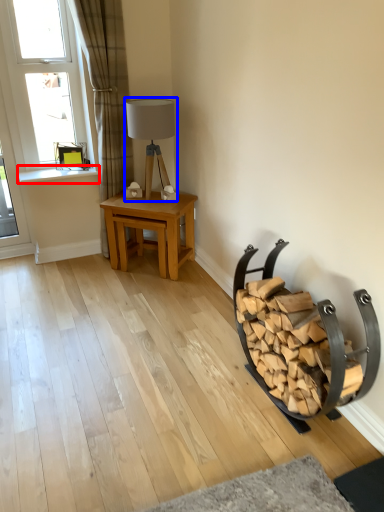
Question: Which object appears farthest to the camera in this image, window sill (highlighted by a red box) or table lamp (highlighted by a blue box)?

Choices:
 (A) window sill
 (B) table lamp

Answer: (A)